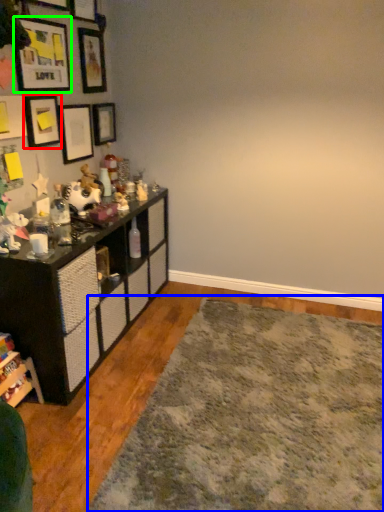
Question: Estimate the real-world distances between objects in this image. Which object is farther from picture frame (highlighted by a red box), mat (highlighted by a blue box) or picture frame (highlighted by a green box)?

Choices:
 (A) mat
 (B) picture frame

Answer: (A)